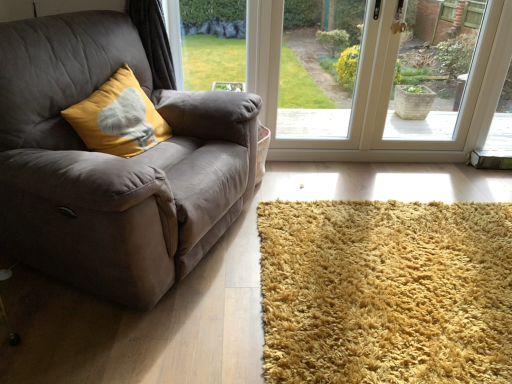
Question: From the image's perspective, is transparent glass window at center beneath green grass at upper center, the 1th window screen in the left-to-right sequence?

Choices:
 (A) no
 (B) yes

Answer: (B)

Question: Is transparent glass window at center facing towards green grass at upper center, the 3th window screen from the right?

Choices:
 (A) no
 (B) yes

Answer: (B)

Question: Is transparent glass window at center not inside green grass at upper center, the 3th window screen from the right?

Choices:
 (A) no
 (B) yes

Answer: (B)

Question: Are transparent glass window at center and green grass at upper center, the 1th window screen in the left-to-right sequence, located far from each other?

Choices:
 (A) yes
 (B) no

Answer: (A)

Question: Does transparent glass window at center have a lesser width compared to green grass at upper center, the 3th window screen from the right?

Choices:
 (A) yes
 (B) no

Answer: (B)

Question: Considering the positions of point (226, 33) and point (290, 77), is point (226, 33) closer or farther from the camera than point (290, 77)?

Choices:
 (A) closer
 (B) farther

Answer: (B)

Question: Is green grass at upper center, the 3th window screen from the right, taller or shorter than transparent glass door at center, the second window screen positioned from the left?

Choices:
 (A) tall
 (B) short

Answer: (B)

Question: Considering the positions of green grass at upper center, the 1th window screen in the left-to-right sequence, and transparent glass door at center, acting as the 2th window screen starting from the right, in the image, is green grass at upper center, the 1th window screen in the left-to-right sequence, bigger or smaller than transparent glass door at center, acting as the 2th window screen starting from the right,?

Choices:
 (A) big
 (B) small

Answer: (B)

Question: From the image's perspective, is green grass at upper center, the 1th window screen in the left-to-right sequence, located above or below transparent glass door at center, acting as the 2th window screen starting from the right?

Choices:
 (A) above
 (B) below

Answer: (A)

Question: Is shaggy golden rug at lower right to the left or to the right of transparent glass door at center, the second window screen positioned from the left, in the image?

Choices:
 (A) right
 (B) left

Answer: (A)

Question: Would you say shaggy golden rug at lower right is inside or outside transparent glass door at center, acting as the 2th window screen starting from the right?

Choices:
 (A) inside
 (B) outside

Answer: (B)

Question: Is shaggy golden rug at lower right in front of or behind transparent glass door at center, the second window screen positioned from the left, in the image?

Choices:
 (A) behind
 (B) front

Answer: (B)

Question: Is shaggy golden rug at lower right wider or thinner than transparent glass door at center, acting as the 2th window screen starting from the right?

Choices:
 (A) thin
 (B) wide

Answer: (B)

Question: Is transparent glass window at center wider or thinner than shaggy golden rug at lower right?

Choices:
 (A) thin
 (B) wide

Answer: (A)

Question: Would you say transparent glass window at center is inside or outside shaggy golden rug at lower right?

Choices:
 (A) outside
 (B) inside

Answer: (A)